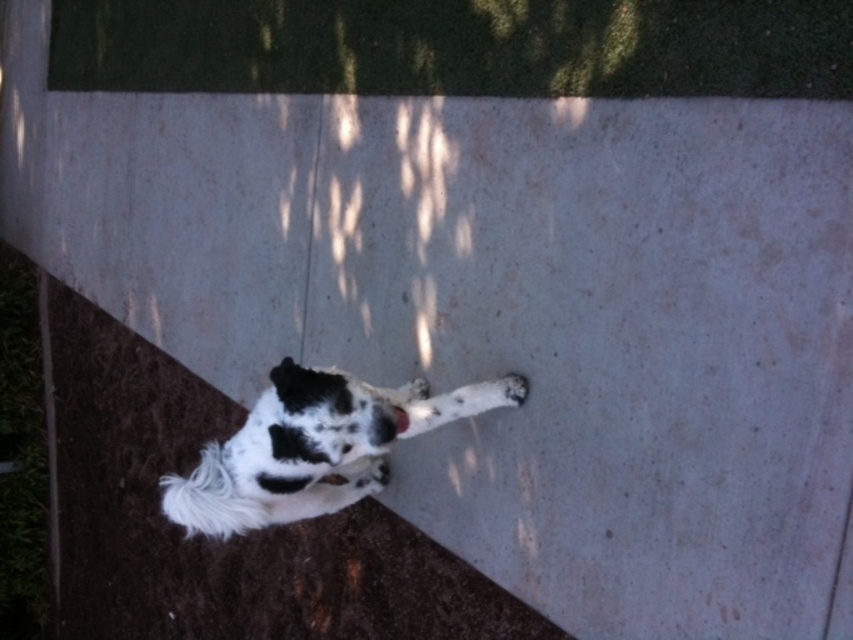
Question: Can you confirm if white fur paw at center is positioned to the right of white fur paw at lower right?

Choices:
 (A) yes
 (B) no

Answer: (B)

Question: Which of the following is the closest to the observer?

Choices:
 (A) white fur paw at center
 (B) white fur dog at lower left

Answer: (B)

Question: Which object appears closest to the camera in this image?

Choices:
 (A) white fur dog at lower left
 (B) white fur paw at lower right
 (C) white fur paw at center

Answer: (A)

Question: Which point appears farthest from the camera in this image?

Choices:
 (A) (413, 392)
 (B) (526, 392)
 (C) (370, 467)

Answer: (C)

Question: In this image, where is white fur paw at center located relative to white fur paw at lower right?

Choices:
 (A) left
 (B) right

Answer: (A)

Question: Does white fur dog at lower left have a smaller size compared to white fur paw at lower right?

Choices:
 (A) no
 (B) yes

Answer: (A)